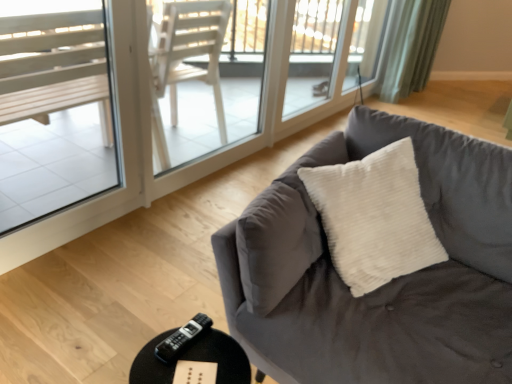
What do you see at coordinates (366, 40) in the screenshot? I see `transparent glass window at upper center, which is counted as the 2th window, starting from the bottom` at bounding box center [366, 40].

What do you see at coordinates (325, 59) in the screenshot?
I see `transparent glass screen door at upper center, the 1th screen door positioned from the right` at bounding box center [325, 59].

The image size is (512, 384). Describe the element at coordinates (411, 46) in the screenshot. I see `green fabric curtain at upper right` at that location.

At what (x,y) coordinates should I click in order to perform the action: click on green fabric curtain at upper right. Please return your answer as a coordinate pair (x, y). The width and height of the screenshot is (512, 384). Looking at the image, I should click on (411, 46).

Measure the distance between black plastic remote at lower center and camera.

black plastic remote at lower center is 1.09 meters away from camera.

Where is `velvet gray couch at center`? velvet gray couch at center is located at coordinates (382, 286).

Locate an element on the screen. The width and height of the screenshot is (512, 384). window above the transparent glass screen door at upper center, which appears as the second screen door when viewed from the left (from the image's perspective) is located at coordinates (366, 40).

From the image's perspective, is transparent glass screen door at upper center, placed as the 2th screen door when sorted from front to back, on transparent glass window at upper center, which is counted as the 2th window, starting from the bottom?

Actually, transparent glass screen door at upper center, placed as the 2th screen door when sorted from front to back, appears below transparent glass window at upper center, which is counted as the 2th window, starting from the bottom, in the image.

Which is behind, point (307, 106) or point (359, 53)?

The point (359, 53) is behind.

Considering the relative positions of velvet gray couch at center and transparent glass window at upper center, the 1th window in the back-to-front sequence, in the image provided, is velvet gray couch at center to the right of transparent glass window at upper center, the 1th window in the back-to-front sequence, from the viewer's perspective?

Incorrect, velvet gray couch at center is not on the right side of transparent glass window at upper center, the 1th window in the back-to-front sequence.

Is velvet gray couch at center situated inside transparent glass window at upper center, the first window when ordered from top to bottom, or outside?

velvet gray couch at center is not enclosed by transparent glass window at upper center, the first window when ordered from top to bottom.

From the image's perspective, does velvet gray couch at center appear higher than transparent glass window at upper center, which ranks as the 1th window in right-to-left order?

Actually, velvet gray couch at center appears below transparent glass window at upper center, which ranks as the 1th window in right-to-left order, in the image.

From a real-world perspective, starting from the velvet gray couch at center, which window is the 1st one vertically above it? Please provide its 2D coordinates.

[(366, 40)]

Could you tell me if clear glass window at left, which is the 1th window in left-to-right order, is facing transparent glass window at upper center, which is counted as the 2th window, starting from the bottom?

No, clear glass window at left, which is the 1th window in left-to-right order, does not turn towards transparent glass window at upper center, which is counted as the 2th window, starting from the bottom.

From the picture: Is clear glass window at left, which is the 1th window in left-to-right order, beside transparent glass window at upper center, which is counted as the 2th window, starting from the bottom?

No, clear glass window at left, which is the 1th window in left-to-right order, is not touching transparent glass window at upper center, which is counted as the 2th window, starting from the bottom.

Consider the image. Considering the sizes of clear glass window at left, which is the 2th window from top to bottom, and transparent glass window at upper center, which ranks as the 1th window in right-to-left order, in the image, is clear glass window at left, which is the 2th window from top to bottom, wider or thinner than transparent glass window at upper center, which ranks as the 1th window in right-to-left order,?

In the image, clear glass window at left, which is the 2th window from top to bottom, appears to be more narrow than transparent glass window at upper center, which ranks as the 1th window in right-to-left order.

In terms of height, does clear glass window at left, which is the first window from bottom to top, look taller or shorter compared to transparent glass window at upper center, which ranks as the 1th window in right-to-left order?

Clearly, clear glass window at left, which is the first window from bottom to top, is taller compared to transparent glass window at upper center, which ranks as the 1th window in right-to-left order.

Could you tell me if transparent glass window at upper center, which is counted as the 2th window, starting from the bottom, is turned towards velvet gray couch at center?

No, transparent glass window at upper center, which is counted as the 2th window, starting from the bottom, is not turned towards velvet gray couch at center.

In the scene shown: How many degrees apart are the facing directions of transparent glass window at upper center, which is the 2th window in front-to-back order, and velvet gray couch at center?

91.3 degrees separate the facing orientations of transparent glass window at upper center, which is the 2th window in front-to-back order, and velvet gray couch at center.

From a real-world perspective, which object stands above the other?

In real-world perspective, transparent glass window at upper center, which is the 2th window in front-to-back order, is above.

From the picture: In terms of size, does transparent glass screen door at upper center, the 1th screen door in the back-to-front sequence, appear bigger or smaller than clear glass window at left, marked as the second window in a right-to-left arrangement?

transparent glass screen door at upper center, the 1th screen door in the back-to-front sequence, is bigger than clear glass window at left, marked as the second window in a right-to-left arrangement.

Which object is positioned more to the left, transparent glass screen door at upper center, placed as the 2th screen door when sorted from front to back, or clear glass window at left, which is the 2th window from top to bottom?

Positioned to the left is clear glass window at left, which is the 2th window from top to bottom.

Is point (278, 131) behind point (18, 158)?

That is True.

Image resolution: width=512 pixels, height=384 pixels. In the image, there is a black plastic remote at lower center. Find the location of `studio couch above it (from the image's perspective)`. studio couch above it (from the image's perspective) is located at coordinates [382, 286].

Which object is closer to the camera taking this photo, velvet gray couch at center or black plastic remote at lower center?

velvet gray couch at center is closer to the camera.

From a real-world perspective, is velvet gray couch at center located higher than black plastic remote at lower center?

Indeed, from a real-world perspective, velvet gray couch at center stands above black plastic remote at lower center.

Does velvet gray couch at center have a larger size compared to black plastic remote at lower center?

Yes.

Consider the image. Are white wood screen door at upper center, which ranks as the 2th screen door in back-to-front order, and transparent glass screen door at upper center, the 1th screen door positioned from the right, located far from each other?

No, white wood screen door at upper center, which ranks as the 2th screen door in back-to-front order, is in close proximity to transparent glass screen door at upper center, the 1th screen door positioned from the right.

Can you tell me how much white wood screen door at upper center, the first screen door viewed from the front, and transparent glass screen door at upper center, the 1th screen door in the back-to-front sequence, differ in facing direction?

The angle between the facing direction of white wood screen door at upper center, the first screen door viewed from the front, and the facing direction of transparent glass screen door at upper center, the 1th screen door in the back-to-front sequence, is 0.301 degrees.

Considering the sizes of objects white wood screen door at upper center, which is the second screen door from right to left, and transparent glass screen door at upper center, the 1th screen door in the back-to-front sequence, in the image provided, who is taller, white wood screen door at upper center, which is the second screen door from right to left, or transparent glass screen door at upper center, the 1th screen door in the back-to-front sequence,?

With more height is transparent glass screen door at upper center, the 1th screen door in the back-to-front sequence.

Locate an element on the screen. window that is the 1st object above the transparent glass screen door at upper center, which appears as the second screen door when viewed from the left (from a real-world perspective) is located at coordinates (366, 40).

What are the coordinates of `studio couch below the transparent glass window at upper center, which ranks as the 1th window in right-to-left order (from a real-world perspective)` in the screenshot? It's located at (382, 286).

Based on their spatial positions, is velvet gray couch at center or transparent glass screen door at upper center, the 1th screen door in the back-to-front sequence, closer to transparent glass window at upper center, the 1th window in the back-to-front sequence?

Based on the image, transparent glass screen door at upper center, the 1th screen door in the back-to-front sequence, appears to be nearer to transparent glass window at upper center, the 1th window in the back-to-front sequence.

Considering their positions, is green fabric curtain at upper right positioned further to black plastic remote at lower center than velvet gray couch at center?

green fabric curtain at upper right is further to black plastic remote at lower center.

From the image, which object appears to be nearer to green fabric curtain at upper right, white wood screen door at upper center, which ranks as the 2th screen door in back-to-front order, or velvet gray couch at center?

Based on the image, white wood screen door at upper center, which ranks as the 2th screen door in back-to-front order, appears to be nearer to green fabric curtain at upper right.

Estimate the real-world distances between objects in this image. Which object is closer to transparent glass screen door at upper center, placed as the 2th screen door when sorted from front to back, green fabric curtain at upper right or velvet gray couch at center?

green fabric curtain at upper right is closer to transparent glass screen door at upper center, placed as the 2th screen door when sorted from front to back.

When comparing their distances from transparent glass screen door at upper center, the 1th screen door in the back-to-front sequence, does clear glass window at left, marked as the second window in a right-to-left arrangement, or velvet gray couch at center seem further?

velvet gray couch at center lies further to transparent glass screen door at upper center, the 1th screen door in the back-to-front sequence, than the other object.

Estimate the real-world distances between objects in this image. Which object is further from clear glass window at left, which is the 1th window in left-to-right order, green fabric curtain at upper right or transparent glass window at upper center, which ranks as the 1th window in right-to-left order?

Based on the image, green fabric curtain at upper right appears to be further to clear glass window at left, which is the 1th window in left-to-right order.

When comparing their distances from clear glass window at left, which is the 1th window in left-to-right order, does green fabric curtain at upper right or white wood screen door at upper center, which ranks as the 2th screen door in back-to-front order, seem further?

Among the two, green fabric curtain at upper right is located further to clear glass window at left, which is the 1th window in left-to-right order.

Based on their spatial positions, is velvet gray couch at center or clear glass window at left, marked as the 2th window in a back-to-front arrangement, closer to black plastic remote at lower center?

Based on the image, velvet gray couch at center appears to be nearer to black plastic remote at lower center.

Image resolution: width=512 pixels, height=384 pixels. I want to click on screen door between white wood screen door at upper center, which ranks as the 2th screen door in back-to-front order, and green fabric curtain at upper right, so click(325, 59).

Identify the location of window between black plastic remote at lower center and transparent glass window at upper center, the first window when ordered from top to bottom, along the z-axis. This screenshot has height=384, width=512. (53, 108).

Find the location of a particular element. window positioned between black plastic remote at lower center and transparent glass screen door at upper center, the 1th screen door positioned from the right, from near to far is located at coordinates (53, 108).

Where is `window positioned between velvet gray couch at center and transparent glass window at upper center, which is the 2th window in front-to-back order, from near to far`? Image resolution: width=512 pixels, height=384 pixels. window positioned between velvet gray couch at center and transparent glass window at upper center, which is the 2th window in front-to-back order, from near to far is located at coordinates (53, 108).